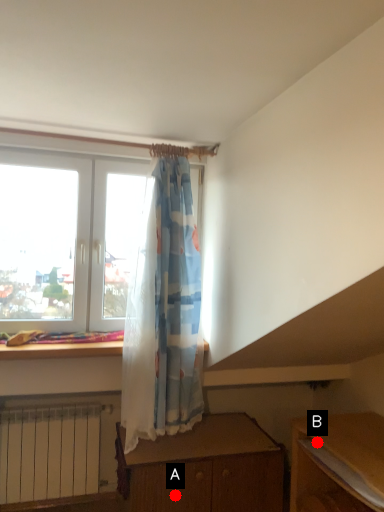
Question: Two points are circled on the image, labeled by A and B beside each circle. Which point is farther from the camera taking this photo?

Choices:
 (A) A is further
 (B) B is further

Answer: (A)